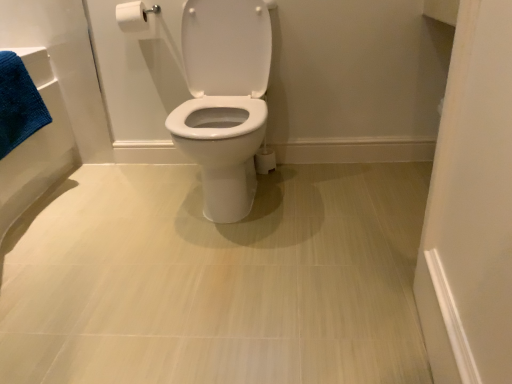
Question: Relative to white glossy toilet at center, is white matte toilet paper at upper left in front or behind?

Choices:
 (A) behind
 (B) front

Answer: (A)

Question: Considering the positions of point (140, 14) and point (15, 299), is point (140, 14) closer or farther from the camera than point (15, 299)?

Choices:
 (A) closer
 (B) farther

Answer: (B)

Question: Which of these objects is positioned farthest from the white matte toilet paper at upper left?

Choices:
 (A) blue cotton bath towel at left
 (B) white glossy toilet at center

Answer: (B)

Question: Estimate the real-world distances between objects in this image. Which object is farther from the blue cotton bath towel at left?

Choices:
 (A) white matte toilet paper at upper left
 (B) white glossy toilet at center

Answer: (B)